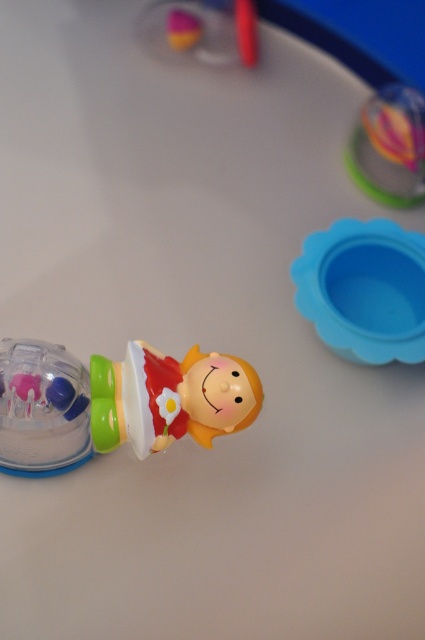
Is translucent plastic doll at center in front of transparent plastic spinner at left?

Yes.

Who is higher up, translucent plastic doll at center or transparent plastic spinner at left?

translucent plastic doll at center

This screenshot has width=425, height=640. Describe the element at coordinates (170, 397) in the screenshot. I see `translucent plastic doll at center` at that location.

Locate an element on the screen. This screenshot has height=640, width=425. translucent plastic doll at center is located at coordinates (170, 397).

Who is more forward, (345, 276) or (14, 403)?

Point (14, 403) is in front.

Is blue rubber bowl at center right further to the viewer compared to transparent plastic spinner at left?

Yes, blue rubber bowl at center right is further from the viewer.

Which is in front, point (401, 323) or point (68, 412)?

Point (68, 412) is more forward.

Identify the location of blue rubber bowl at center right. The width and height of the screenshot is (425, 640). (365, 289).

Does blue rubber bowl at center right appear on the right side of translucent plastic ball at upper right?

Incorrect, blue rubber bowl at center right is not on the right side of translucent plastic ball at upper right.

The height and width of the screenshot is (640, 425). In order to click on blue rubber bowl at center right in this screenshot , I will do `click(365, 289)`.